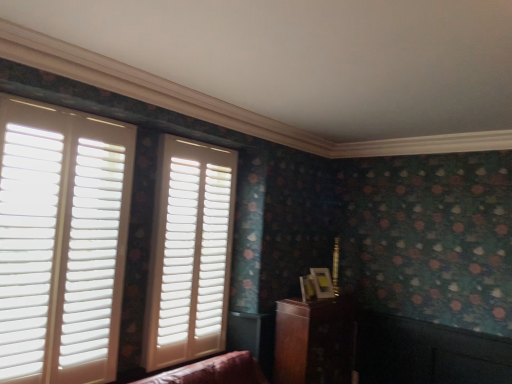
Where is `free spot above white matte shutters at center, which is counted as the first window, starting from the right (from a real-world perspective)`? free spot above white matte shutters at center, which is counted as the first window, starting from the right (from a real-world perspective) is located at coordinates (202, 146).